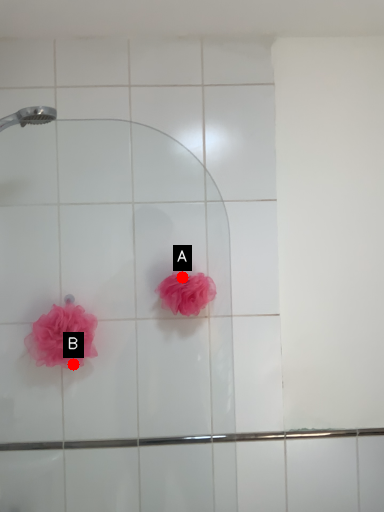
Question: Two points are circled on the image, labeled by A and B beside each circle. Which of the following is the farthest from the observer?

Choices:
 (A) A is further
 (B) B is further

Answer: (B)